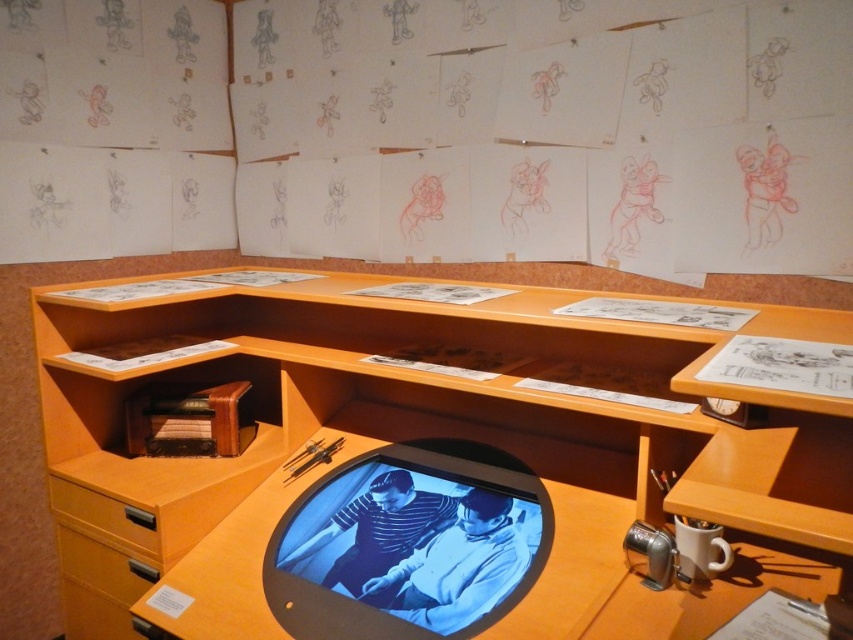
Between blue glossy computer monitor at center and orange wood drawer at lower left, which one has less height?

With less height is orange wood drawer at lower left.

What do you see at coordinates (403, 548) in the screenshot? The width and height of the screenshot is (853, 640). I see `blue glossy computer monitor at center` at bounding box center [403, 548].

Is point (525, 557) closer to camera compared to point (123, 561)?

That is True.

This screenshot has width=853, height=640. Identify the location of blue glossy computer monitor at center. (403, 548).

Can you confirm if matte wood shelf at center is smaller than matte wood drawer at lower left?

No, matte wood shelf at center is not smaller than matte wood drawer at lower left.

Can you confirm if matte wood shelf at center is thinner than matte wood drawer at lower left?

No.

Is point (120, 388) behind point (97, 508)?

Yes.

Find the location of a particular element. The image size is (853, 640). matte wood shelf at center is located at coordinates (404, 435).

Can you confirm if matte wood shelf at center is positioned above blue glossy computer monitor at center?

Correct, matte wood shelf at center is located above blue glossy computer monitor at center.

Is matte wood shelf at center bigger than blue glossy computer monitor at center?

Correct, matte wood shelf at center is larger in size than blue glossy computer monitor at center.

Between point (259, 324) and point (364, 536), which one is positioned behind?

Positioned behind is point (259, 324).

This screenshot has width=853, height=640. I want to click on matte wood shelf at center, so click(x=404, y=435).